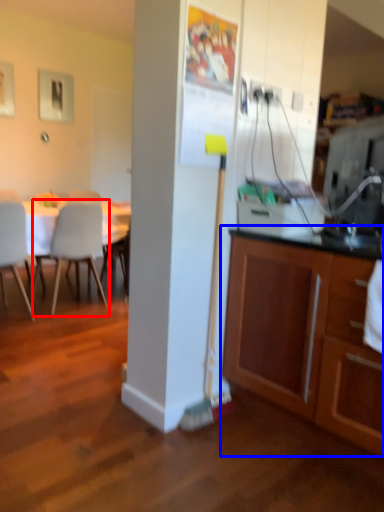
Question: Which of the following is the closest to the observer, chair (highlighted by a red box) or cabinetry (highlighted by a blue box)?

Choices:
 (A) chair
 (B) cabinetry

Answer: (B)